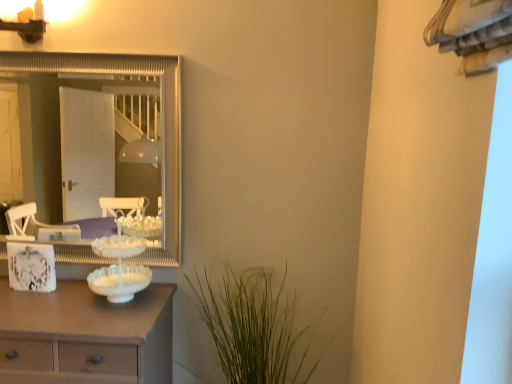
This screenshot has width=512, height=384. What are the coordinates of `vacant space that is in between matte white picture frame at left and white frosted glass candle holder at center` in the screenshot? It's located at pyautogui.click(x=61, y=298).